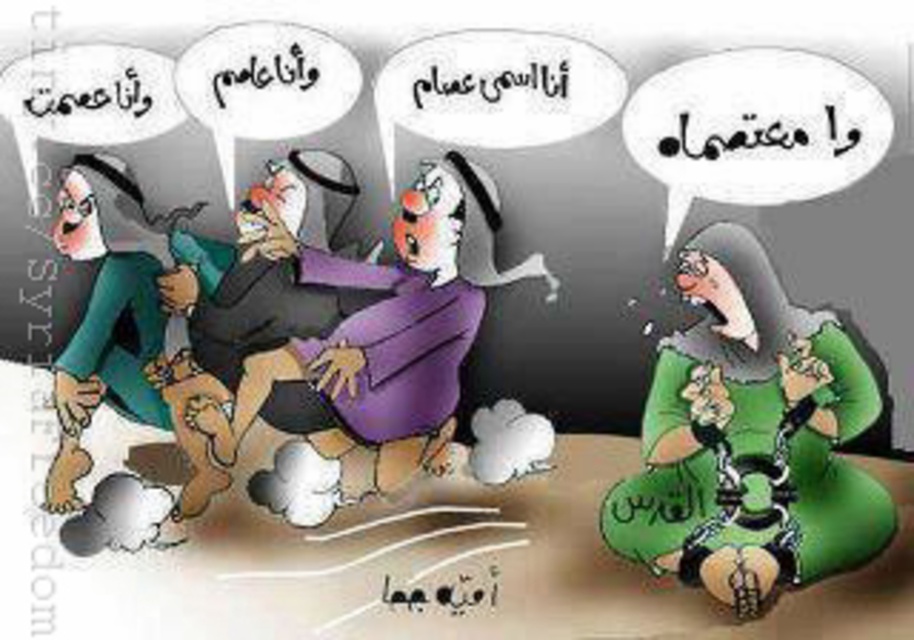
Between purple matte dress at center and matte green dress at left, which one appears on the right side from the viewer's perspective?

purple matte dress at center is more to the right.

Which is more to the left, purple matte dress at center or matte green dress at left?

matte green dress at left is more to the left.

This screenshot has width=914, height=640. I want to click on purple matte dress at center, so click(356, 349).

Identify the location of purple matte dress at center. (356, 349).

Does green matte dress at lower right lie behind matte green dress at left?

Yes, green matte dress at lower right is further from the viewer.

Which is in front, point (665, 536) or point (104, 310)?

Point (104, 310) is more forward.

Locate an element on the screen. green matte dress at lower right is located at coordinates (750, 438).

Which is above, green matte dress at lower right or purple matte dress at center?

purple matte dress at center is above.

Consider the image. Is green matte dress at lower right taller than purple matte dress at center?

Yes, green matte dress at lower right is taller than purple matte dress at center.

Locate an element on the screen. This screenshot has width=914, height=640. green matte dress at lower right is located at coordinates (750, 438).

In order to click on green matte dress at lower right in this screenshot , I will do `click(750, 438)`.